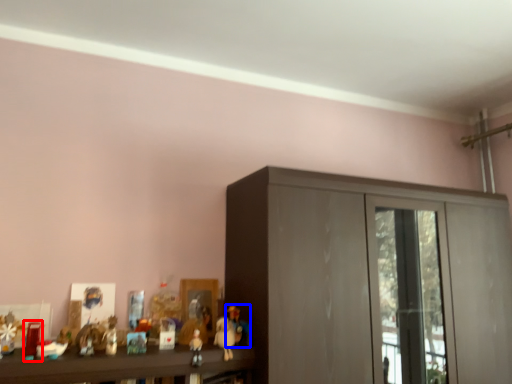
Question: Among these objects, which one is farthest to the camera, toy (highlighted by a red box) or toy (highlighted by a blue box)?

Choices:
 (A) toy
 (B) toy

Answer: (B)